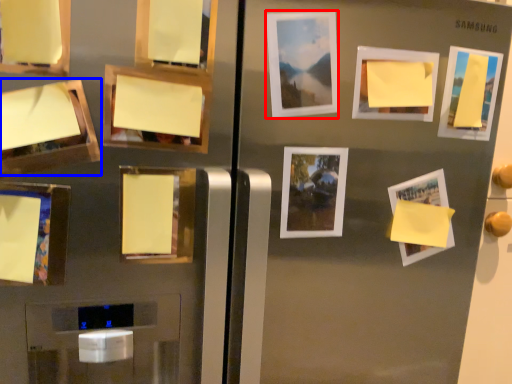
Question: Among these objects, which one is nearest to the camera, picture frame (highlighted by a red box) or picture frame (highlighted by a blue box)?

Choices:
 (A) picture frame
 (B) picture frame

Answer: (B)